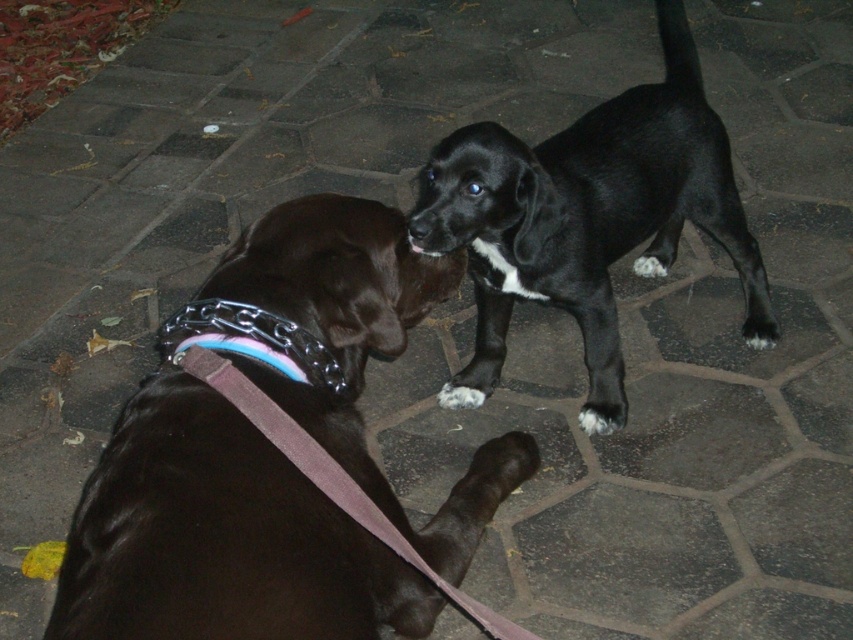
You are a dog trainer who needs to separate two dogs to prevent a potential fight. The dogs are the adult chocolate Labrador Retriever on the left and the black glossy fur at upper right. Given that your dog leash is 1.5 meters long, can you safely reach both dogs with the leash to separate them?

The distance between the adult chocolate Labrador Retriever on the left and the black glossy fur at upper right is 1.46 meters. Since the leash is 1.5 meters long, you can safely reach both dogs to separate them as the leash length exceeds the distance between them.

You are a dog owner who wants to attach a new leash to your dog. The black glossy fur at upper right belongs to your puppy. Is the purple fabric leash at lower center within reach of your puppy?

The black glossy fur at upper right is 30.56 inches away from the purple fabric leash at lower center. Since the distance is more than the typical reach of a small dog, the purple fabric leash at lower center is out of reach of the puppy.